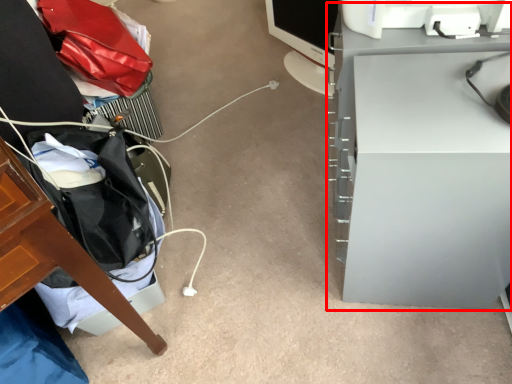
Question: From the image's perspective, what is the correct spatial positioning of computer desk (annotated by the red box) in reference to computer monitor?

Choices:
 (A) below
 (B) above

Answer: (A)